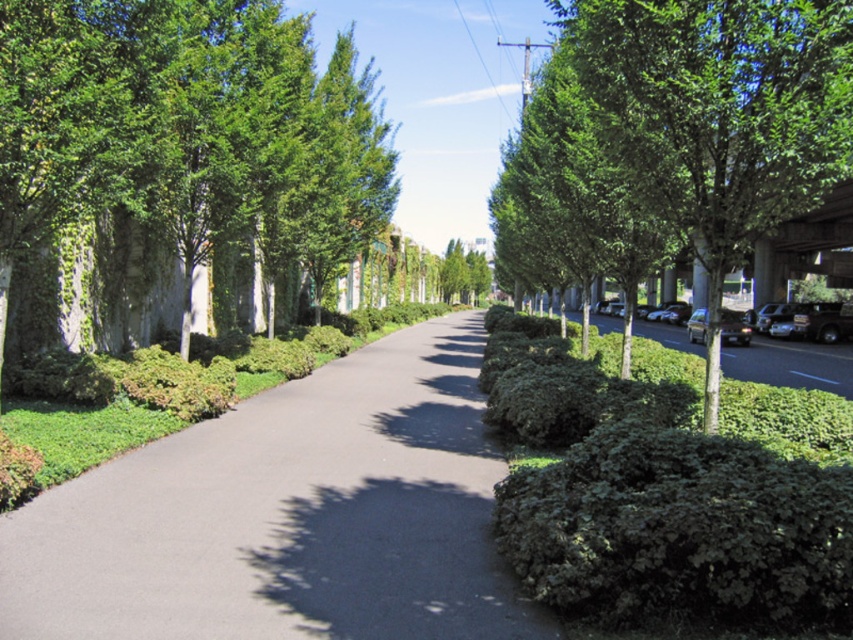
Does green leafy tree at left appear over shiny black sedan at right?

Indeed, green leafy tree at left is positioned over shiny black sedan at right.

Where is `green leafy tree at left`? The height and width of the screenshot is (640, 853). green leafy tree at left is located at coordinates (184, 131).

The image size is (853, 640). In order to click on green leafy tree at left in this screenshot , I will do `click(184, 131)`.

Does green leafy hedge at right have a smaller size compared to metallic silver car at right?

Incorrect, green leafy hedge at right is not smaller in size than metallic silver car at right.

Who is more distant from viewer, [579,513] or [675,323]?

The point [675,323] is more distant.

Where is `green leafy hedge at right`? This screenshot has width=853, height=640. green leafy hedge at right is located at coordinates (668, 486).

Is metallic silver car at right positioned in front of blue glossy line at center?

No, metallic silver car at right is further to the viewer.

Looking at this image, which is below, metallic silver car at right or blue glossy line at center?

blue glossy line at center is below.

Between point (650, 312) and point (817, 376), which one is positioned behind?

The point (650, 312) is behind.

What are the coordinates of `metallic silver car at right` in the screenshot? It's located at (671, 312).